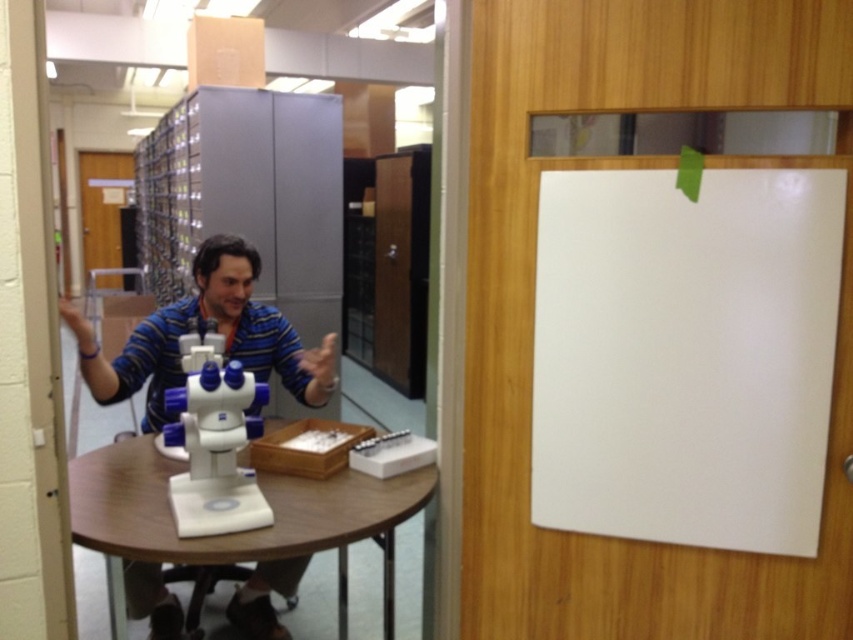
You are standing in the office and want to pick up the blue plastic microscope at center and the white plastic microscope at center. Which one can you reach without moving closer to the table?

The blue plastic microscope at center is closer to the viewer than the white plastic microscope at center, so you can reach the blue plastic microscope at center without moving closer to the table.

You are standing in the office and need to place a new label on the microscope. The label must go on the microscope that is to the right. Which microscope should you choose between the blue plastic microscope at center and the white plastic microscope at center?

The white plastic microscope at center is to the right of the blue plastic microscope at center, so you should place the label on the white plastic microscope at center.